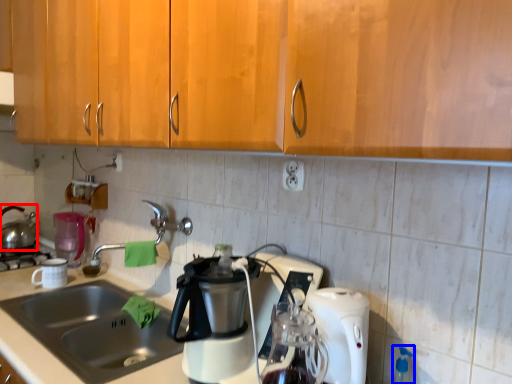
Question: Among these objects, which one is farthest to the camera, kettle (highlighted by a red box) or bottle (highlighted by a blue box)?

Choices:
 (A) kettle
 (B) bottle

Answer: (A)